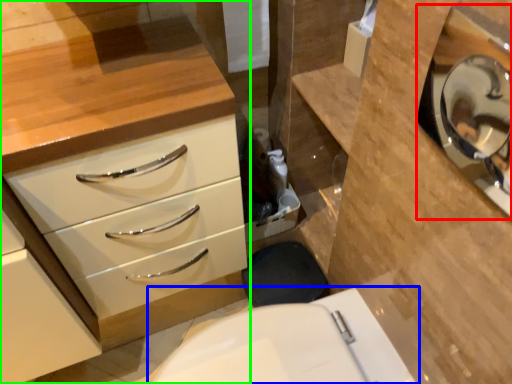
Question: Which object is positioned closest to medicine cabinet (highlighted by a red box)? Select from toilet (highlighted by a blue box) and chest of drawers (highlighted by a green box).

Choices:
 (A) toilet
 (B) chest of drawers

Answer: (A)